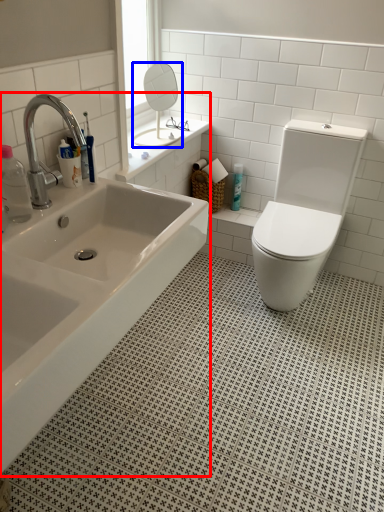
Question: Among these objects, which one is nearest to the camera, bathtub (highlighted by a red box) or mirror (highlighted by a blue box)?

Choices:
 (A) bathtub
 (B) mirror

Answer: (A)